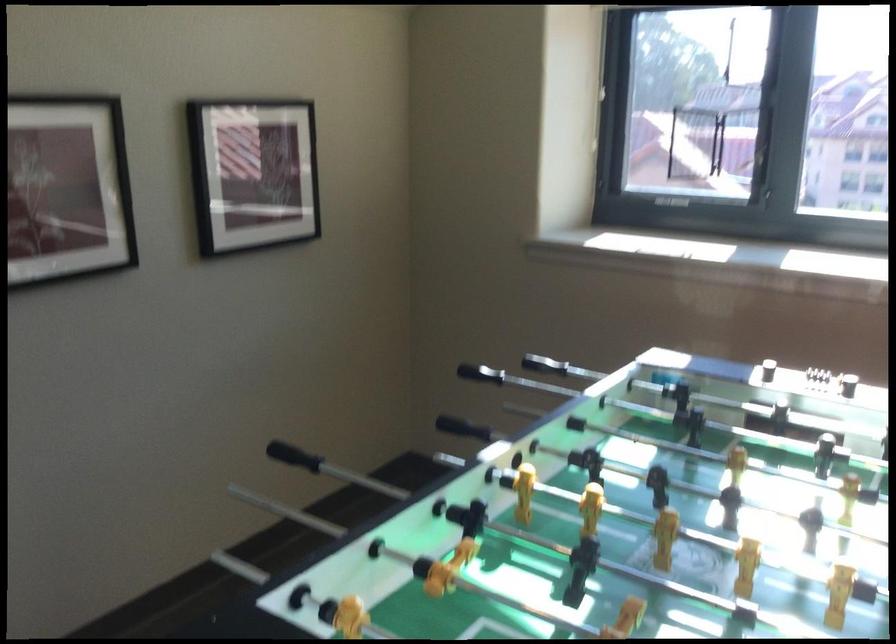
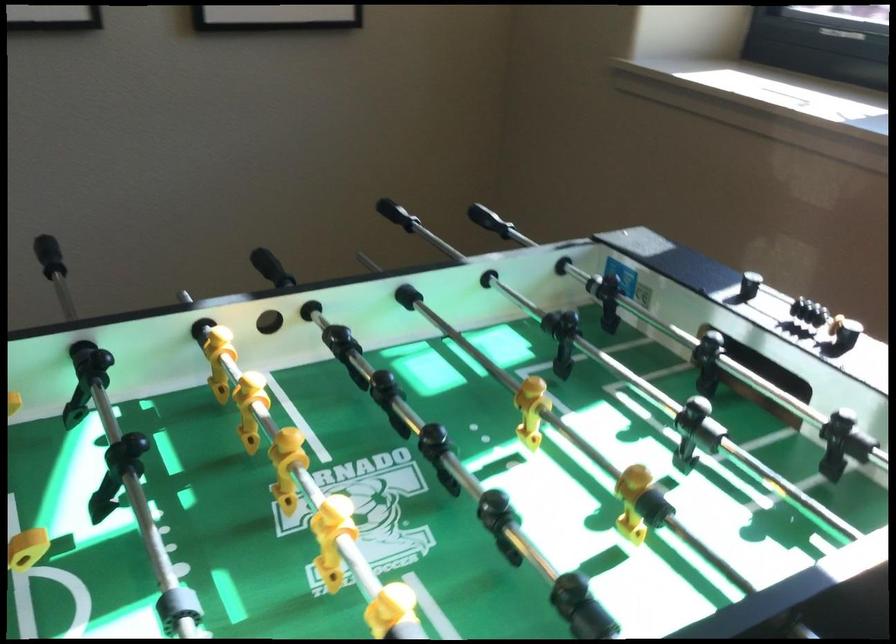
Where in the second image is the point corresponding to (340,384) from the first image?

(397, 214)